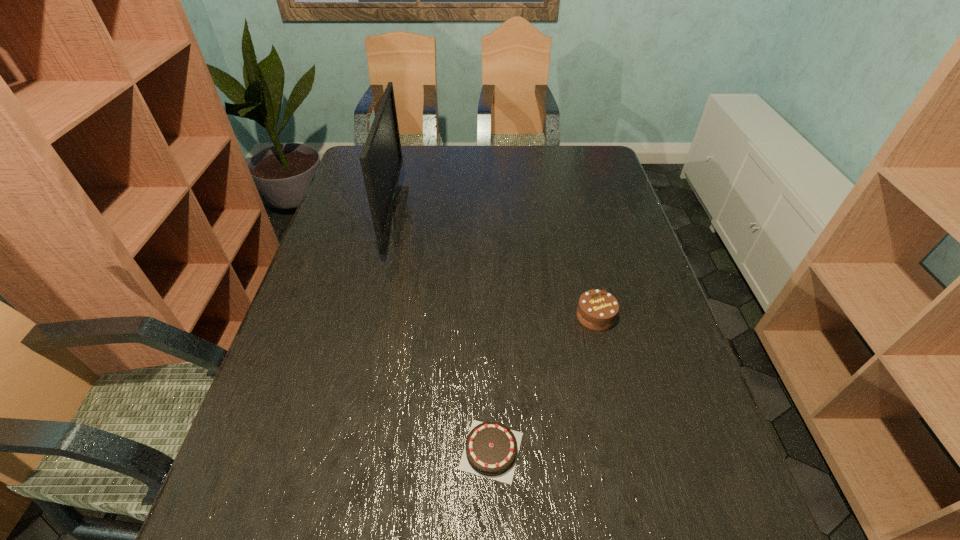
Locate an element on the screen. The height and width of the screenshot is (540, 960). object that is positioned at the right edge is located at coordinates [x=597, y=310].

Locate an element on the screen. blank space at the far edge of the desktop is located at coordinates (458, 180).

Where is `free space at the left edge of the desktop`? free space at the left edge of the desktop is located at coordinates (345, 236).

Locate an element on the screen. The width and height of the screenshot is (960, 540). vacant region at the right edge of the desktop is located at coordinates (612, 200).

The width and height of the screenshot is (960, 540). Find the location of `free spot between the nearer chocolate cake and the farthest object`. free spot between the nearer chocolate cake and the farthest object is located at coordinates (444, 334).

Identify the location of vacant space that is in between the shortest object and the rightmost object. This screenshot has width=960, height=540. (543, 383).

Find the location of a particular element. unoccupied position between the right chocolate cake and the leftmost object is located at coordinates (495, 267).

Locate an element on the screen. This screenshot has height=540, width=960. blank region between the farther chocolate cake and the shorter chocolate cake is located at coordinates (543, 383).

Locate an element on the screen. free spot between the tallest object and the second tallest object is located at coordinates (495, 267).

I want to click on vacant area that lies between the rightmost object and the shortest object, so click(543, 383).